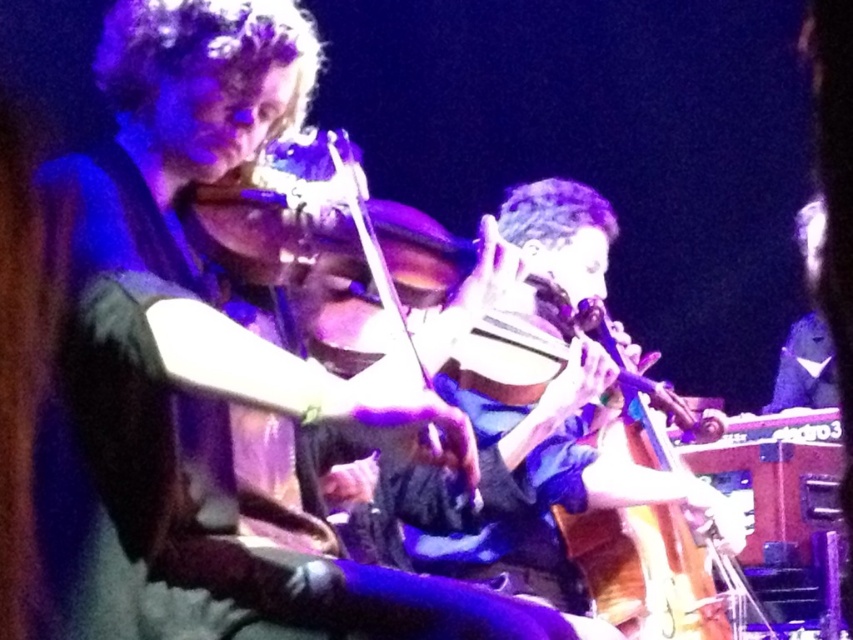
You are a stagehand setting up microphones for the two violins in the image. The microphone stands are adjustable, but each has a fixed height. The stand for the matte black violin at upper center needs to be shorter than the one for the wooden violin at center. Which violin requires the shorter microphone stand?

The matte black violin at upper center requires the shorter microphone stand because it is shorter than the wooden violin at center.

You are a stagehand setting up for a concert. You have two violins to place on the stage. The matte black violin at upper center and the wooden violin at center. Which violin should you choose if you need a larger one for a solo performance?

The wooden violin at center is larger in size compared to the matte black violin at upper center, so you should choose the wooden violin at center for the solo performance.

Looking at this image, you are a photographer at a concert and want to capture the matte black violin at upper center. The stage has a blue spotlight at point (202, 365). Will the spotlight illuminate the violin?

Yes, the spotlight at point (202, 365) corresponds to the location of the matte black violin at upper center, so the spotlight will illuminate it.